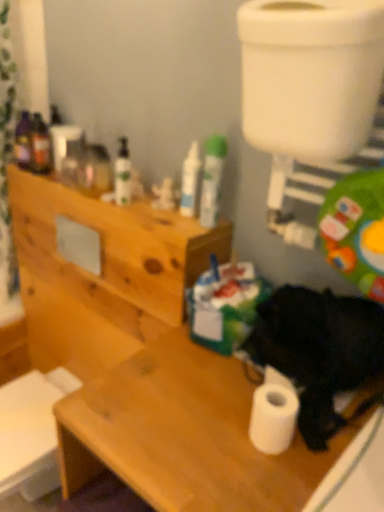
Find the location of a particular element. free space that is in between white matte tube at center, which appears as the 1th toiletry when viewed from the right, and matte green bottle at upper center, which appears as the 1th toiletry when viewed from the left is located at coordinates (165, 212).